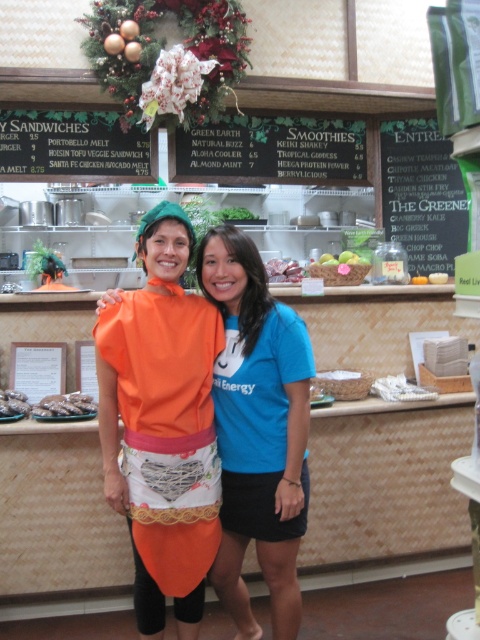
You are designing a new menu layout for the cafe and want to place a decorative border around both the green chalkboard at upper center and the brown crumbly cookies at center. If the border width must be the same for both, which object will require a longer border length?

The green chalkboard at upper center will require a longer border length because its width is greater than the brown crumbly cookies at center, so the perimeter would be larger.